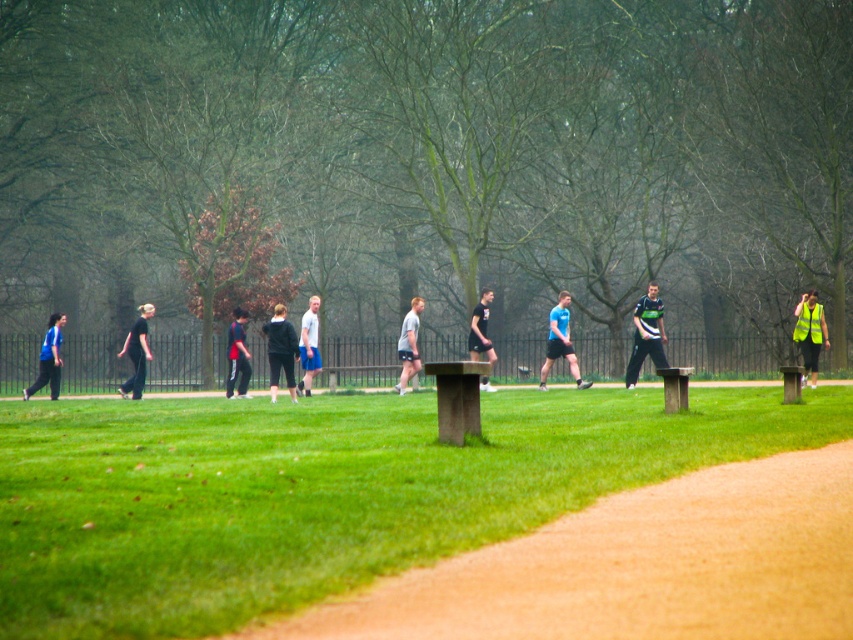
Question: Is black fabric pants at left to the left of light gray fabric shorts at center from the viewer's perspective?

Choices:
 (A) yes
 (B) no

Answer: (A)

Question: Which point is closer to the camera?

Choices:
 (A) (315, 323)
 (B) (473, 356)
 (C) (643, 310)

Answer: (C)

Question: Among these points, which one is farthest from the camera?

Choices:
 (A) (283, 340)
 (B) (403, 346)
 (C) (489, 353)

Answer: (C)

Question: Which object appears farthest from the camera in this image?

Choices:
 (A) wooden bench at center
 (B) green grass at center
 (C) matte blue shirt at left
 (D) black fabric pants at left

Answer: (A)

Question: Is black matte jacket at center further to the viewer compared to yellow reflective vest at right?

Choices:
 (A) yes
 (B) no

Answer: (A)

Question: Can you confirm if light gray fabric shorts at center is bigger than black fabric shirt at center?

Choices:
 (A) yes
 (B) no

Answer: (B)